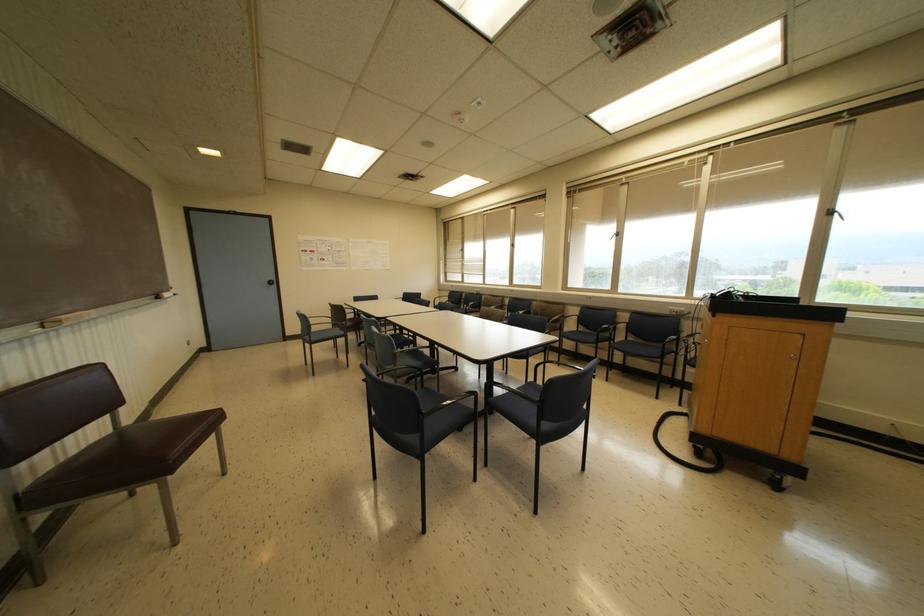
Find the location of `brown chair sitting surface`. brown chair sitting surface is located at coordinates (131, 450).